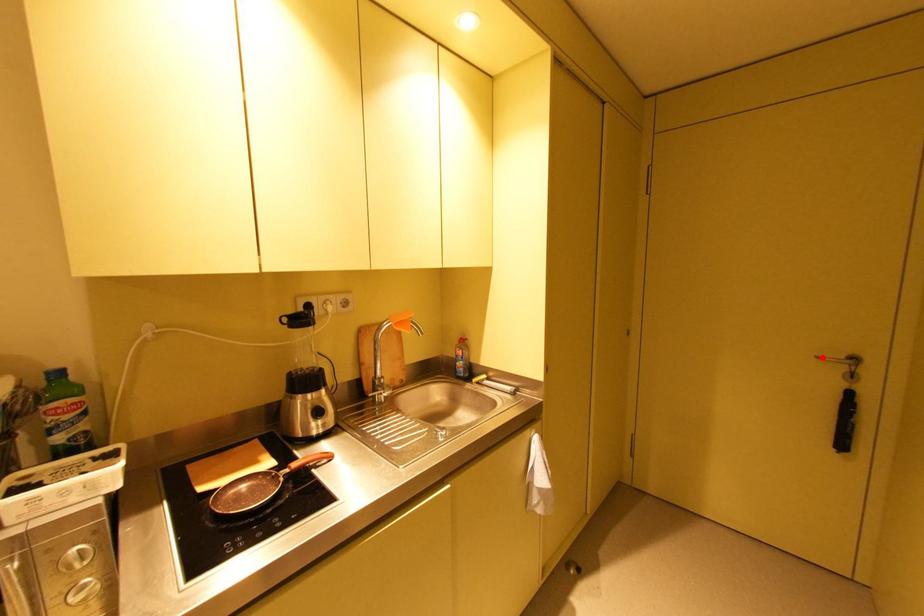
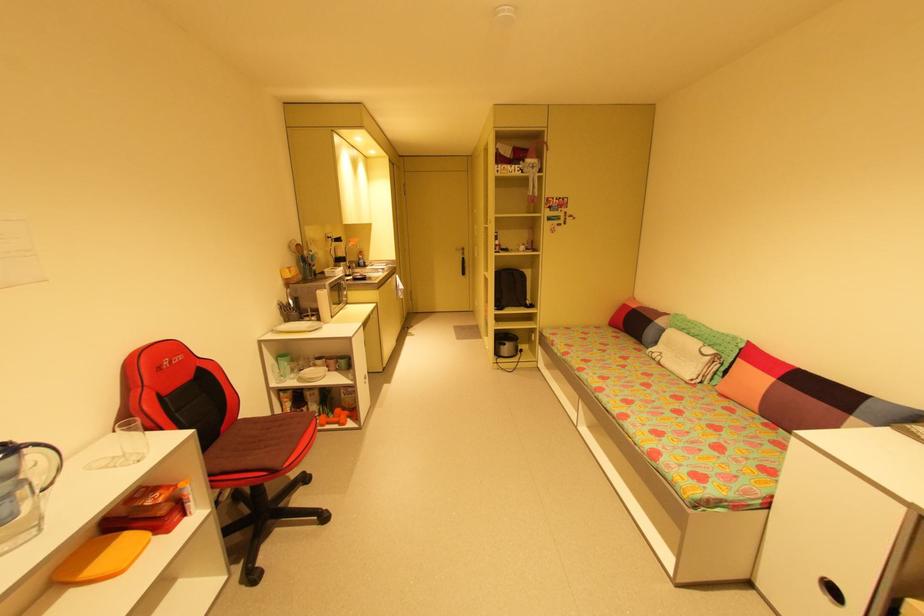
Find the pixel in the second image that matches the highlighted location in the first image.

(460, 249)